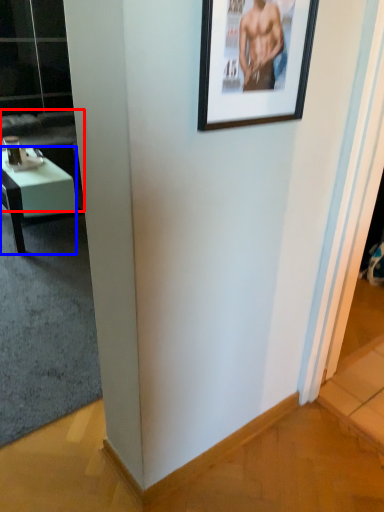
Question: Which object is further to the camera taking this photo, couch (highlighted by a red box) or desk (highlighted by a blue box)?

Choices:
 (A) couch
 (B) desk

Answer: (A)